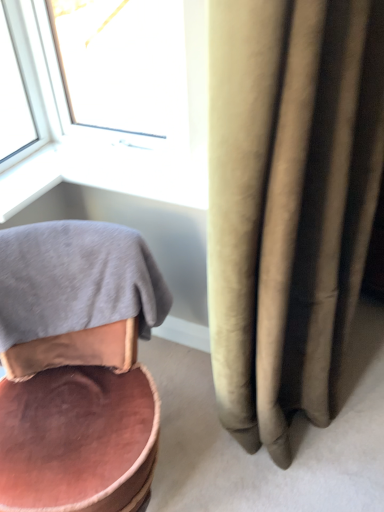
Question: Is gray cotton bath towel at lower left not within pink velvet chair at lower left?

Choices:
 (A) yes
 (B) no

Answer: (B)

Question: From the image's perspective, is gray cotton bath towel at lower left beneath pink velvet chair at lower left?

Choices:
 (A) yes
 (B) no

Answer: (B)

Question: Would you consider gray cotton bath towel at lower left to be distant from pink velvet chair at lower left?

Choices:
 (A) no
 (B) yes

Answer: (A)

Question: Can you confirm if gray cotton bath towel at lower left is smaller than pink velvet chair at lower left?

Choices:
 (A) no
 (B) yes

Answer: (B)

Question: Does gray cotton bath towel at lower left contain pink velvet chair at lower left?

Choices:
 (A) yes
 (B) no

Answer: (B)

Question: Considering their positions, is gray cotton bath towel at lower left located in front of or behind pink velvet chair at lower left?

Choices:
 (A) behind
 (B) front

Answer: (A)

Question: Would you say gray cotton bath towel at lower left is to the left or to the right of pink velvet chair at lower left in the picture?

Choices:
 (A) right
 (B) left

Answer: (B)

Question: From the image's perspective, is gray cotton bath towel at lower left positioned above or below pink velvet chair at lower left?

Choices:
 (A) above
 (B) below

Answer: (A)

Question: In terms of size, does gray cotton bath towel at lower left appear bigger or smaller than pink velvet chair at lower left?

Choices:
 (A) small
 (B) big

Answer: (A)

Question: Which is correct: gray cotton bath towel at lower left is inside white plastic window at upper left, or outside of it?

Choices:
 (A) outside
 (B) inside

Answer: (A)

Question: Considering the positions of point (127, 263) and point (175, 72), is point (127, 263) closer or farther from the camera than point (175, 72)?

Choices:
 (A) farther
 (B) closer

Answer: (B)

Question: Based on their positions, is gray cotton bath towel at lower left located to the left or right of white plastic window at upper left?

Choices:
 (A) left
 (B) right

Answer: (A)

Question: Looking at the image, does gray cotton bath towel at lower left seem bigger or smaller compared to white plastic window at upper left?

Choices:
 (A) big
 (B) small

Answer: (A)

Question: Is point coord(64,98) positioned closer to the camera than point coord(168,297)?

Choices:
 (A) closer
 (B) farther

Answer: (B)

Question: Based on their positions, is white plastic window at upper left located to the left or right of pink velvet chair at lower left?

Choices:
 (A) left
 (B) right

Answer: (B)